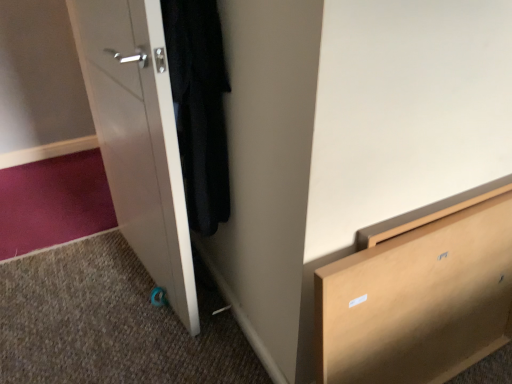
Locate an element on the screen. The height and width of the screenshot is (384, 512). white glossy door at left is located at coordinates click(x=139, y=137).

This screenshot has width=512, height=384. In order to click on white glossy door at left in this screenshot , I will do `click(139, 137)`.

From the picture: Between light brown wooden chest of drawers at lower right and white glossy door at left, which one has more height?

Standing taller between the two is white glossy door at left.

Would you say light brown wooden chest of drawers at lower right is a long distance from white glossy door at left?

No.

From a real-world perspective, is light brown wooden chest of drawers at lower right physically below white glossy door at left?

Yes, from a real-world perspective, light brown wooden chest of drawers at lower right is under white glossy door at left.

Can you confirm if black matte coat at left is shorter than white glossy door at left?

Yes.

Is the depth of black matte coat at left greater than that of white glossy door at left?

Yes, it is behind white glossy door at left.

From the image's perspective, would you say black matte coat at left is shown under white glossy door at left?

No.

Is point (197, 101) positioned behind point (148, 45)?

Yes, it is behind point (148, 45).

Is black matte coat at left positioned far away from light brown wooden chest of drawers at lower right?

No.

Locate an element on the screen. Image resolution: width=512 pixels, height=384 pixels. clothing on the left of light brown wooden chest of drawers at lower right is located at coordinates (199, 107).

From the image's perspective, which is above, black matte coat at left or light brown wooden chest of drawers at lower right?

black matte coat at left is shown above in the image.

Which object is positioned more to the left, black matte coat at left or light brown wooden chest of drawers at lower right?

black matte coat at left is more to the left.

From the image's perspective, is light brown wooden chest of drawers at lower right located above black matte coat at left?

No, from the image's perspective, light brown wooden chest of drawers at lower right is not over black matte coat at left.

Is light brown wooden chest of drawers at lower right positioned with its back to black matte coat at left?

Yes, light brown wooden chest of drawers at lower right is positioned with its back facing black matte coat at left.

Does light brown wooden chest of drawers at lower right contain black matte coat at left?

No, black matte coat at left is not surrounded by light brown wooden chest of drawers at lower right.

At what (x,y) coordinates should I click in order to perform the action: click on clothing on the left of light brown wooden chest of drawers at lower right. Please return your answer as a coordinate pair (x, y). The height and width of the screenshot is (384, 512). Looking at the image, I should click on (199, 107).

Is white glossy door at left aimed at light brown wooden chest of drawers at lower right?

No.

Which point is more forward, (141, 226) or (424, 220)?

Point (424, 220)

From the image's perspective, does white glossy door at left appear lower than light brown wooden chest of drawers at lower right?

Actually, white glossy door at left appears above light brown wooden chest of drawers at lower right in the image.

From a real-world perspective, who is located lower, white glossy door at left or light brown wooden chest of drawers at lower right?

light brown wooden chest of drawers at lower right is physically lower.

Can you confirm if white glossy door at left is wider than black matte coat at left?

Incorrect, the width of white glossy door at left does not surpass that of black matte coat at left.

Where is `door below the black matte coat at left (from a real-world perspective)`? The height and width of the screenshot is (384, 512). door below the black matte coat at left (from a real-world perspective) is located at coordinates (139, 137).

Are white glossy door at left and black matte coat at left far apart?

Actually, white glossy door at left and black matte coat at left are a little close together.

Based on the photo, can you confirm if white glossy door at left is bigger than black matte coat at left?

Yes.

At what (x,y) coordinates should I click in order to perform the action: click on door behind the light brown wooden chest of drawers at lower right. Please return your answer as a coordinate pair (x, y). Looking at the image, I should click on (139, 137).

This screenshot has width=512, height=384. I want to click on clothing above the white glossy door at left (from the image's perspective), so click(199, 107).

Looking at the image, which one is located further to black matte coat at left, light brown wooden chest of drawers at lower right or white glossy door at left?

light brown wooden chest of drawers at lower right is further to black matte coat at left.

Based on their spatial positions, is white glossy door at left or black matte coat at left further from light brown wooden chest of drawers at lower right?

white glossy door at left lies further to light brown wooden chest of drawers at lower right than the other object.

Estimate the real-world distances between objects in this image. Which object is further from white glossy door at left, black matte coat at left or light brown wooden chest of drawers at lower right?

light brown wooden chest of drawers at lower right is positioned further to the anchor white glossy door at left.

Estimate the real-world distances between objects in this image. Which object is further from white glossy door at left, light brown wooden chest of drawers at lower right or black matte coat at left?

light brown wooden chest of drawers at lower right.

Based on their spatial positions, is black matte coat at left or white glossy door at left further from light brown wooden chest of drawers at lower right?

white glossy door at left is further to light brown wooden chest of drawers at lower right.

Considering their positions, is white glossy door at left positioned further to black matte coat at left than light brown wooden chest of drawers at lower right?

The object further to black matte coat at left is light brown wooden chest of drawers at lower right.

The width and height of the screenshot is (512, 384). Find the location of `clothing between white glossy door at left and light brown wooden chest of drawers at lower right in the horizontal direction`. clothing between white glossy door at left and light brown wooden chest of drawers at lower right in the horizontal direction is located at coordinates (199, 107).